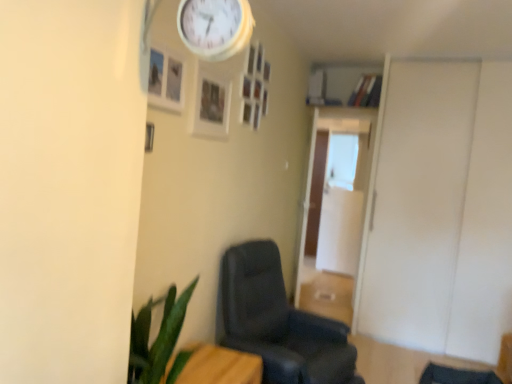
Question: Considering the positions of matte black chair at center and white wooden clock at upper center in the image, is matte black chair at center taller or shorter than white wooden clock at upper center?

Choices:
 (A) short
 (B) tall

Answer: (B)

Question: In the image, is matte black chair at center on the left side or the right side of white wooden clock at upper center?

Choices:
 (A) right
 (B) left

Answer: (A)

Question: Which of these objects is positioned closest to the matte black chair at center?

Choices:
 (A) white wooden clock at upper center
 (B) transparent glass door at center, the 2th glass door from the front
 (C) transparent glass door at center, which ranks as the second glass door in back-to-front order
 (D) white matte door at right
 (E) wooden table at lower left

Answer: (E)

Question: Which is nearer to the white matte door at right?

Choices:
 (A) transparent glass door at center, the 1th glass door when ordered from back to front
 (B) matte black chair at center
 (C) transparent glass door at center, which appears as the first glass door when viewed from the front
 (D) white wooden clock at upper center
 (E) wooden table at lower left

Answer: (C)